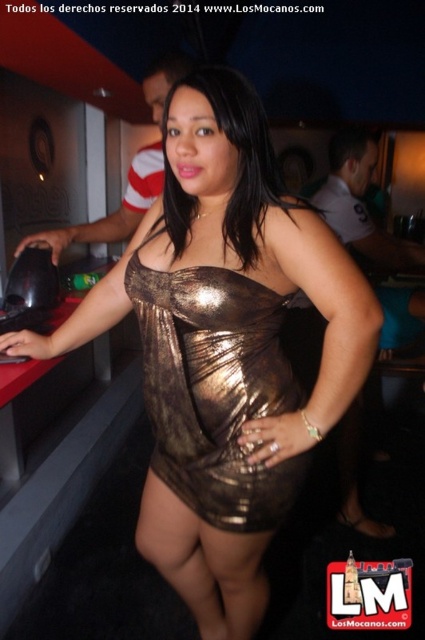
Where is the shiny metallic dress at center located in the image?

The shiny metallic dress at center is located at point (215, 388).

In the scene described, there are two dresses mentioned. The shiny metallic dress at center and the metallic gold dress at center. Which one is positioned to the right of the other?

The shiny metallic dress at center is to the right of the metallic gold dress at center.

You are a fashion designer observing the scene. You notice two dresses in the image. Which dress is taller, the shiny metallic dress at center or the metallic gold dress at center?

The shiny metallic dress at center is much taller than the metallic gold dress at center.